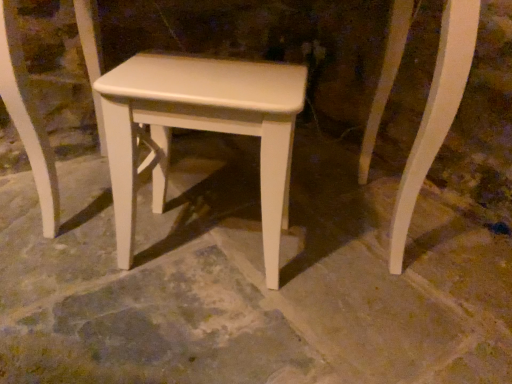
Find the location of a particular element. free space to the back side of white matte stool at center is located at coordinates (223, 194).